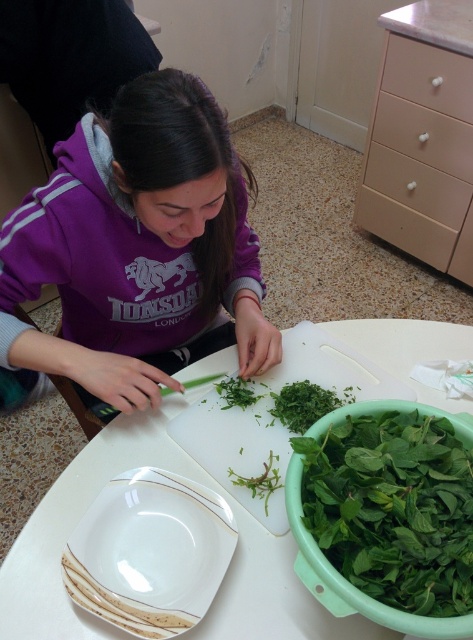
Question: Does beige wood drawer at upper right appear on the left side of white glossy plate at lower left?

Choices:
 (A) no
 (B) yes

Answer: (A)

Question: Does purple fleece hoodie at center come behind beige matte drawer at upper right?

Choices:
 (A) yes
 (B) no

Answer: (B)

Question: Based on their relative distances, which object is farther from the beige matte drawer at upper right?

Choices:
 (A) green leafy vegetable at lower right
 (B) beige wood drawer at upper right
 (C) white plastic table at center
 (D) purple fleece hoodie at center

Answer: (A)

Question: Does beige wood drawer at upper right come behind beige matte drawer at upper right?

Choices:
 (A) no
 (B) yes

Answer: (B)

Question: Which object is the farthest from the beige wood drawer at upper right?

Choices:
 (A) purple fleece hoodie at center
 (B) white plastic table at center
 (C) beige matte drawer at upper right

Answer: (A)

Question: Which of these objects is positioned farthest from the green leafy vegetable at lower right?

Choices:
 (A) beige wood drawer at upper right
 (B) white plastic table at center
 (C) white glossy plate at lower left
 (D) purple fleece hoodie at center

Answer: (A)